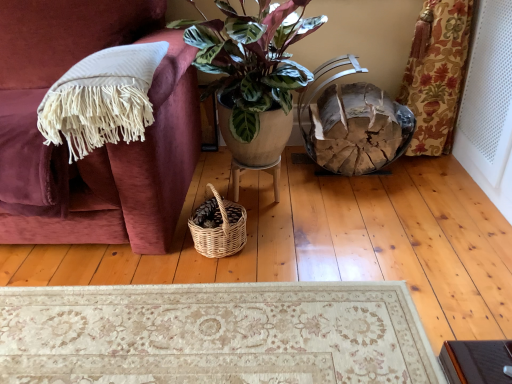
Question: From a real-world perspective, does white perforated screen door at right stand above white fringed blanket at left?

Choices:
 (A) yes
 (B) no

Answer: (B)

Question: Does white perforated screen door at right have a larger size compared to white fringed blanket at left?

Choices:
 (A) yes
 (B) no

Answer: (A)

Question: Considering the relative positions of white perforated screen door at right and white fringed blanket at left in the image provided, is white perforated screen door at right to the right of white fringed blanket at left from the viewer's perspective?

Choices:
 (A) no
 (B) yes

Answer: (B)

Question: Can you confirm if white perforated screen door at right is taller than white fringed blanket at left?

Choices:
 (A) yes
 (B) no

Answer: (A)

Question: Is the position of white perforated screen door at right more distant than that of white fringed blanket at left?

Choices:
 (A) no
 (B) yes

Answer: (B)

Question: From a real-world perspective, is white perforated screen door at right physically below white fringed blanket at left?

Choices:
 (A) yes
 (B) no

Answer: (A)

Question: Is wooden stool at center located outside woven natural picnic basket at lower center?

Choices:
 (A) no
 (B) yes

Answer: (B)

Question: Is there a large distance between wooden stool at center and woven natural picnic basket at lower center?

Choices:
 (A) yes
 (B) no

Answer: (B)

Question: Is wooden stool at center shorter than woven natural picnic basket at lower center?

Choices:
 (A) no
 (B) yes

Answer: (B)

Question: Is wooden stool at center at the left side of woven natural picnic basket at lower center?

Choices:
 (A) yes
 (B) no

Answer: (B)

Question: Does wooden stool at center have a smaller size compared to woven natural picnic basket at lower center?

Choices:
 (A) yes
 (B) no

Answer: (A)

Question: Is wooden stool at center wider than woven natural picnic basket at lower center?

Choices:
 (A) no
 (B) yes

Answer: (B)

Question: Is woven natural picnic basket at lower center completely or partially inside white perforated screen door at right?

Choices:
 (A) no
 (B) yes

Answer: (A)